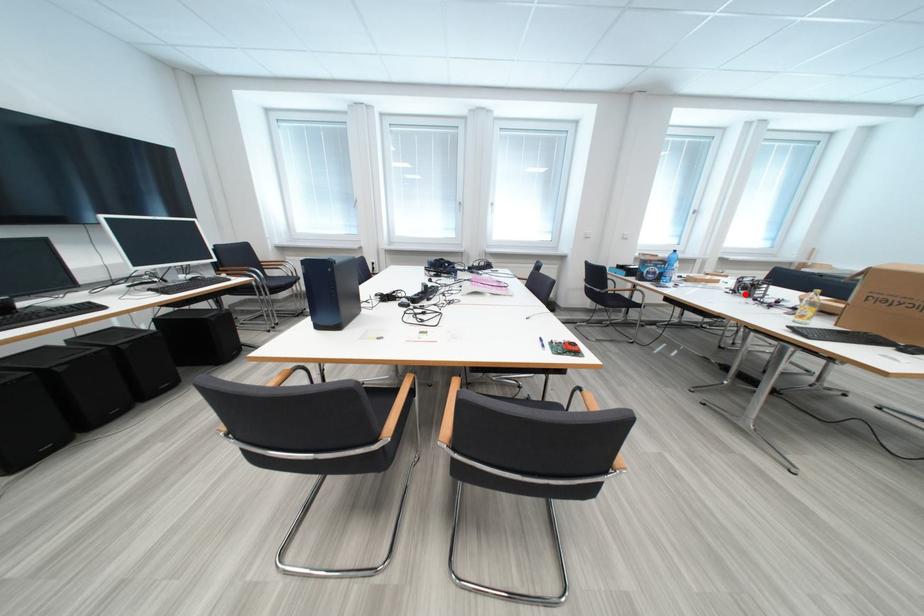
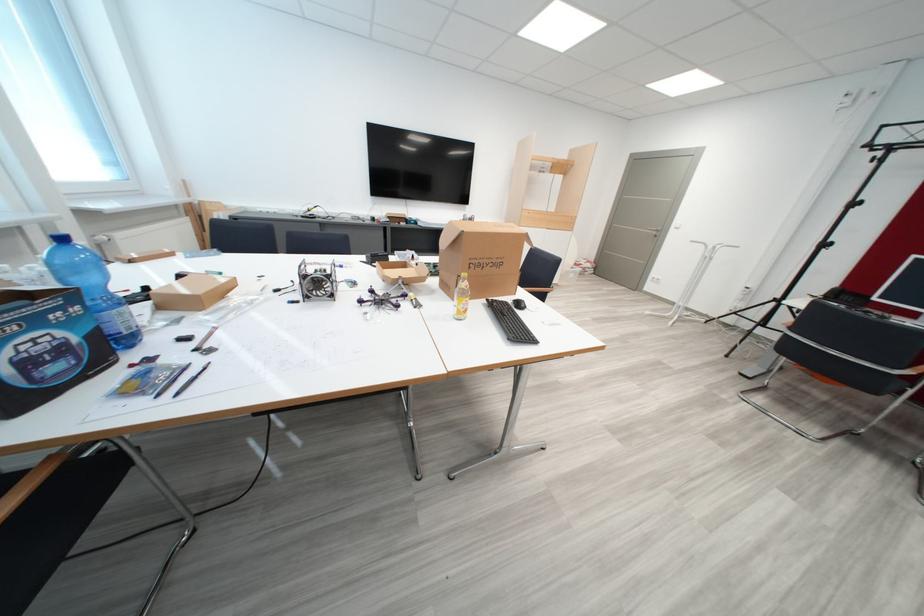
Question: I am providing you with two images of the same scene from different viewpoints. A red point is marked on the first image. Is the red point's position out of view in image 2?

Choices:
 (A) Yes
 (B) No

Answer: (B)